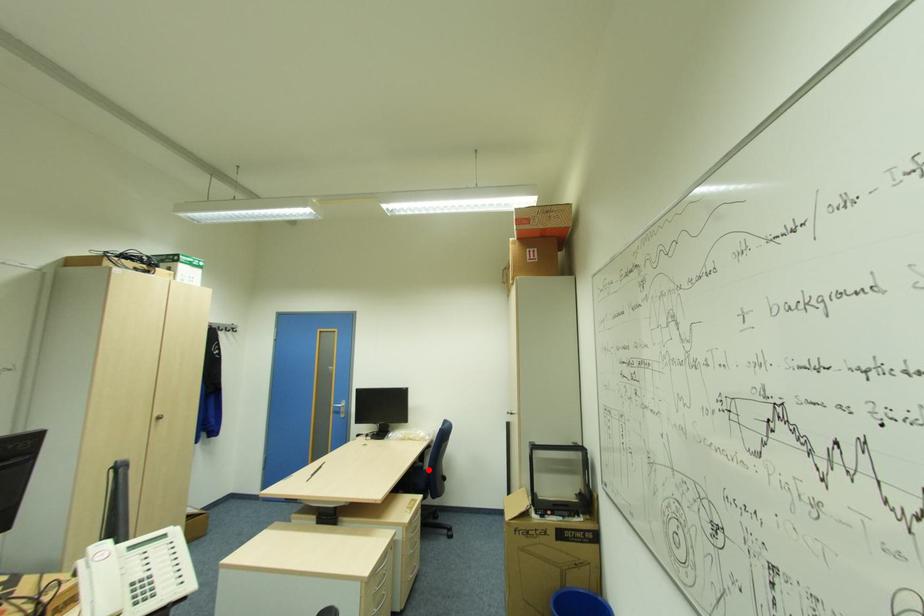
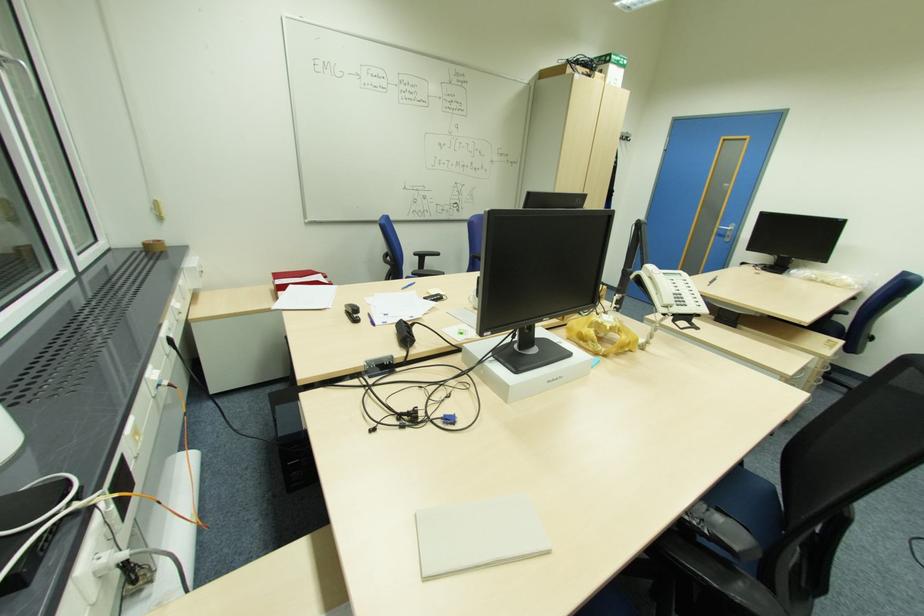
Where in the second image is the point corresponding to the highlighted location from the first image?

(839, 322)